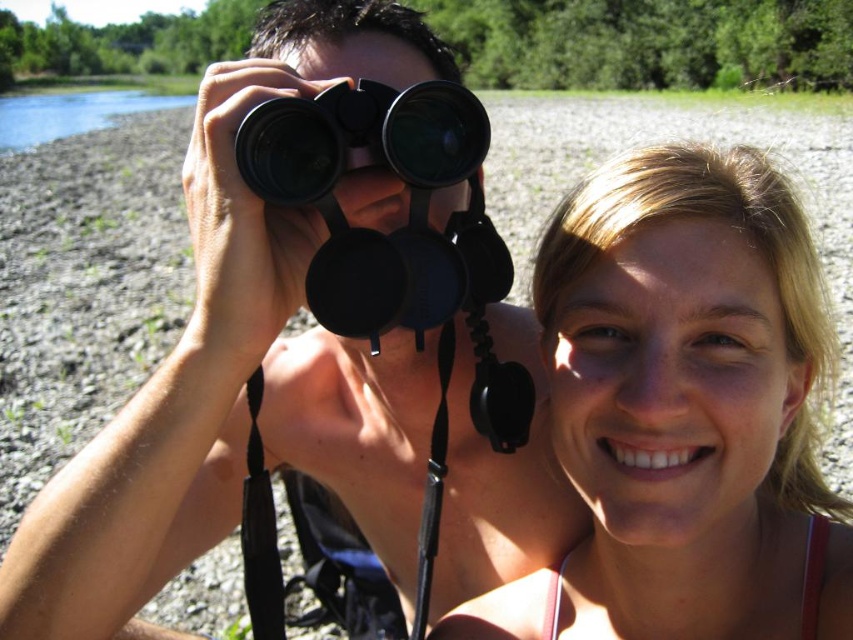
Question: Which of the following is the closest to the observer?

Choices:
 (A) pink fabric bikini top at lower right
 (B) black rubber binoculars at center
 (C) blue water at upper left
 (D) blonde hair at center

Answer: (B)

Question: Where is blonde hair at center located in relation to blue water at upper left in the image?

Choices:
 (A) right
 (B) left

Answer: (A)

Question: Which object is closer to the camera taking this photo?

Choices:
 (A) black matte binoculars at center
 (B) blonde hair at center
 (C) black rubber binoculars at center
 (D) blue water at upper left

Answer: (C)

Question: Which point appears closest to the camera in this image?

Choices:
 (A) (798, 216)
 (B) (811, 596)

Answer: (A)

Question: Does blonde hair at center have a lesser width compared to blue water at upper left?

Choices:
 (A) yes
 (B) no

Answer: (A)

Question: Is the position of black matte binoculars at center less distant than that of pink fabric bikini top at lower right?

Choices:
 (A) yes
 (B) no

Answer: (A)